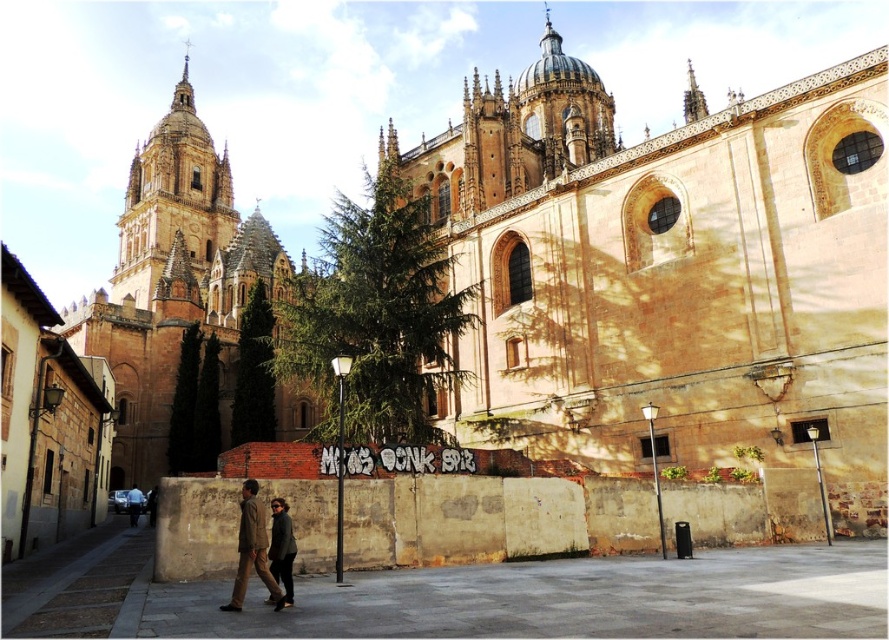
Who is positioned more to the right, dark brown leather jacket at lower center or dark brown leather jacket at lower left?

Positioned to the right is dark brown leather jacket at lower center.

Is point (249, 516) positioned in front of point (138, 508)?

Yes, point (249, 516) is in front of point (138, 508).

At what (x,y) coordinates should I click in order to perform the action: click on dark brown leather jacket at lower center. Please return your answer as a coordinate pair (x, y). The image size is (889, 640). Looking at the image, I should click on (253, 552).

Is the position of dark brown leather jacket at lower center more distant than that of dark gray fabric jacket at lower center?

No, it is in front of dark gray fabric jacket at lower center.

Does point (263, 584) come closer to viewer compared to point (273, 548)?

No, (263, 584) is further to viewer.

Is point (235, 582) less distant than point (271, 506)?

Yes, point (235, 582) is in front of point (271, 506).

Identify the location of dark brown leather jacket at lower center. Image resolution: width=889 pixels, height=640 pixels. (253, 552).

Does beige stone church at center have a greater width compared to brown stone church at upper left?

No, beige stone church at center is not wider than brown stone church at upper left.

Does point (811, 97) come behind point (113, 310)?

No, it is in front of (113, 310).

In order to click on beige stone church at center in this screenshot , I will do `click(669, 269)`.